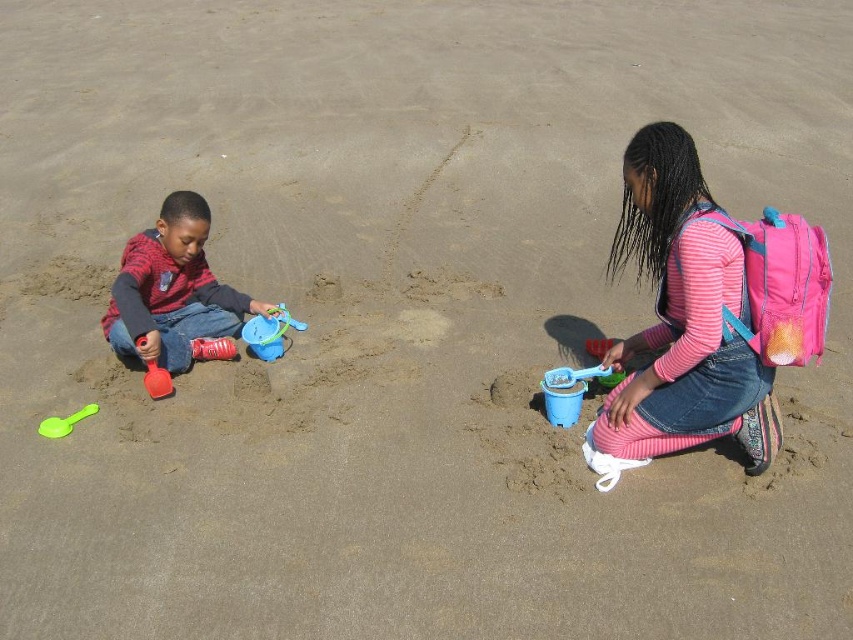
Question: Which object is the farthest from the blue plastic shovel at center?

Choices:
 (A) green plastic spoon at lower left
 (B) matte red shirt at left
 (C) blue plastic bucket at center-left
 (D) rubber red shovel at left

Answer: (A)

Question: Which of the following is the closest to the observer?

Choices:
 (A) blue plastic bucket at center-left
 (B) blue plastic shovel at center
 (C) pink fabric backpack at right

Answer: (C)

Question: Which object is farther from the camera taking this photo?

Choices:
 (A) blue plastic shovel at center
 (B) pink fabric backpack at right
 (C) rubber red shovel at left
 (D) green plastic spoon at lower left

Answer: (C)

Question: From the image, what is the correct spatial relationship of pink fabric backpack at right in relation to blue plastic bucket at center-left?

Choices:
 (A) below
 (B) above

Answer: (B)

Question: Is rubber red shovel at left positioned before green plastic spoon at lower left?

Choices:
 (A) no
 (B) yes

Answer: (A)

Question: Can you confirm if blue plastic shovel at center is smaller than green plastic spoon at lower left?

Choices:
 (A) no
 (B) yes

Answer: (A)